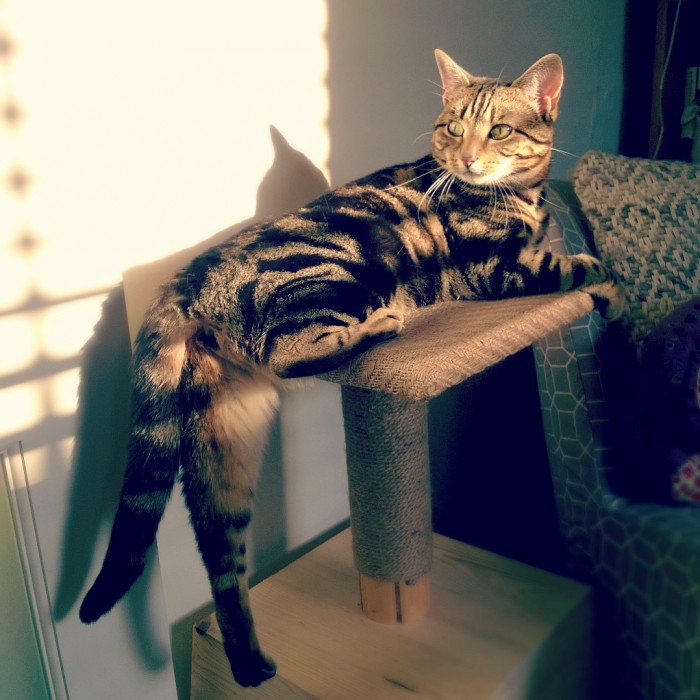
Locate an element on the screen. This screenshot has width=700, height=700. cat tree is located at coordinates (409, 424).